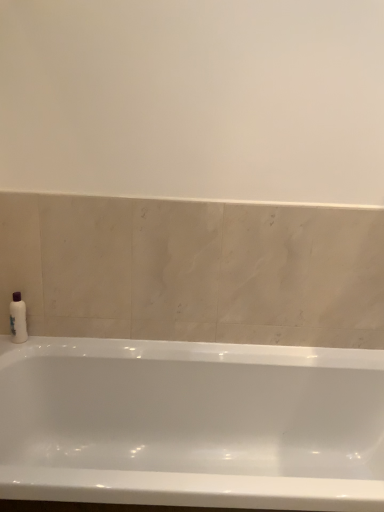
Where is `free location to the right of white plastic bottle at left`? The width and height of the screenshot is (384, 512). free location to the right of white plastic bottle at left is located at coordinates (49, 342).